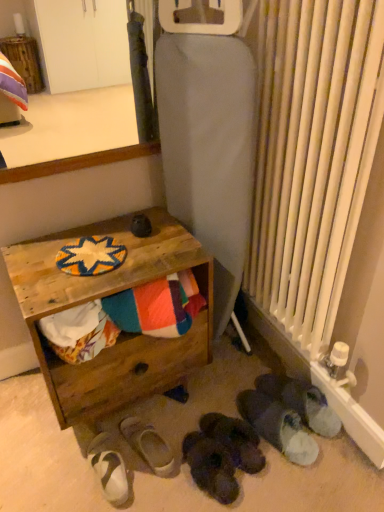
Locate an element on the screen. Image resolution: width=384 pixels, height=512 pixels. free space that is in between white suede sandals at lower left, which appears as the 6th footwear when viewed from the right, and white fabric slipper at lower center, which appears as the fifth footwear when viewed from the right is located at coordinates (134, 474).